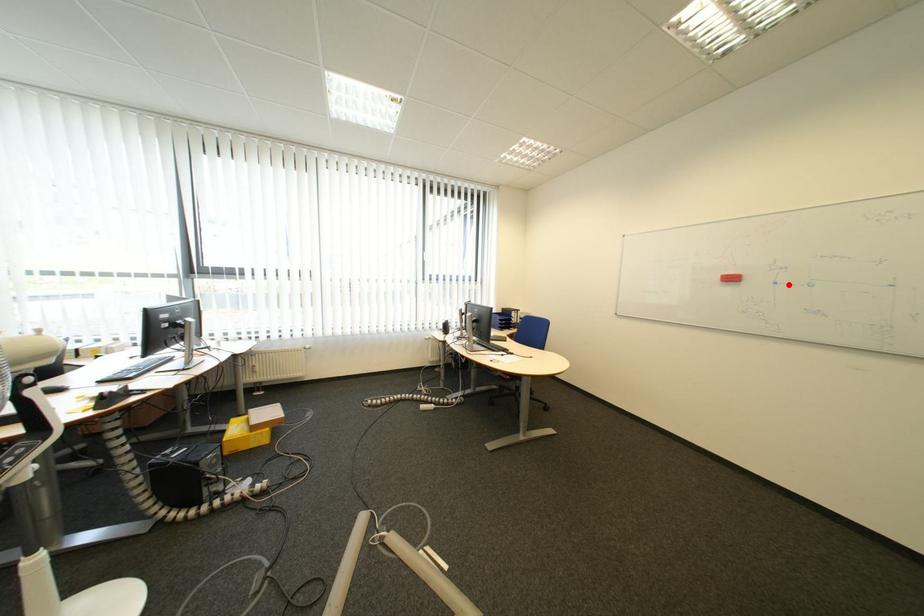
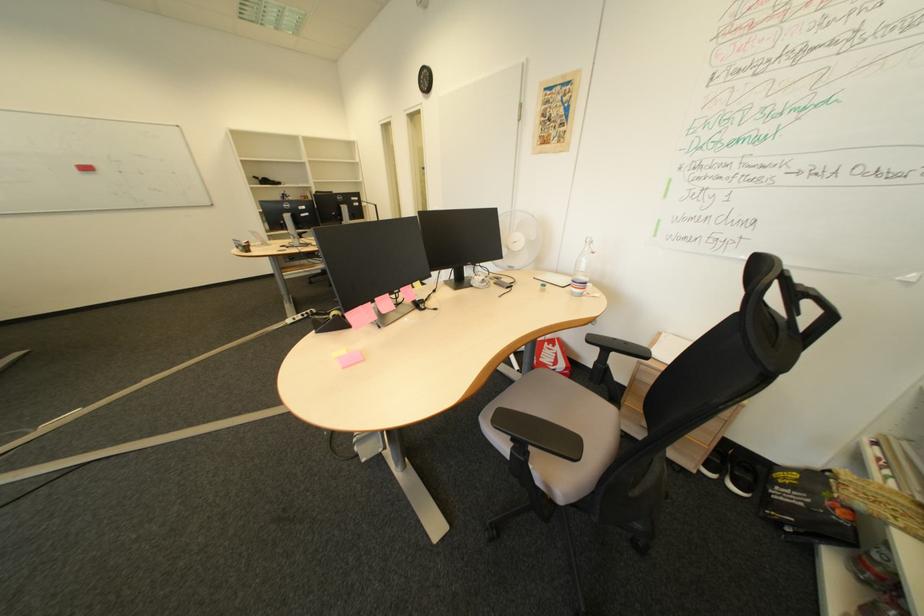
Locate, in the second image, the point that corresponds to the highlighted location in the first image.

(135, 174)